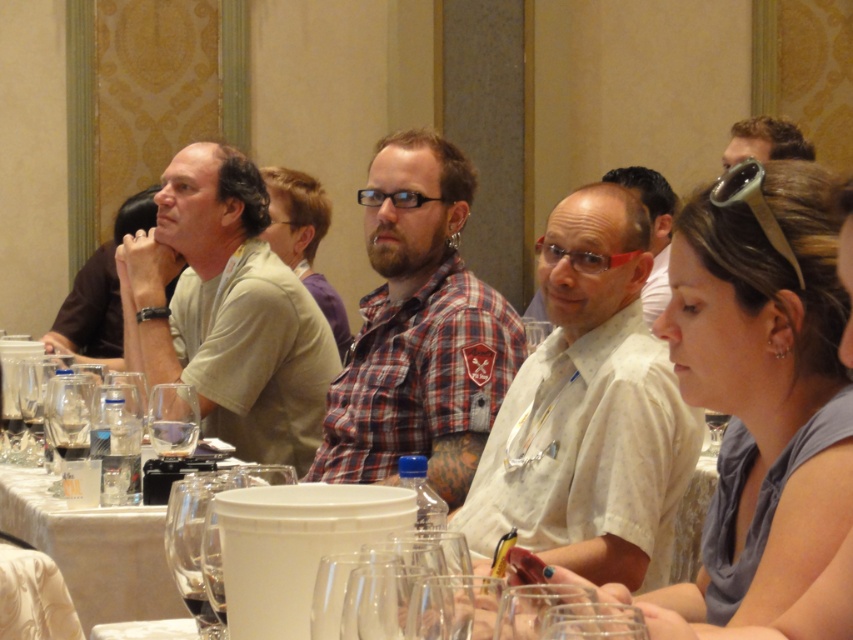
Question: Can you confirm if plaid fabric shirt at center is wider than clear glass wine glass at center?

Choices:
 (A) yes
 (B) no

Answer: (A)

Question: Which of these objects is positioned farthest from the clear glass wine glass at center?

Choices:
 (A) matte white shirt at center
 (B) blonde hair at upper right
 (C) matte black shirt at left

Answer: (B)

Question: Does white dotted shirt at center appear on the left side of clear glass wine glass at center?

Choices:
 (A) no
 (B) yes

Answer: (A)

Question: Among these objects, which one is nearest to the camera?

Choices:
 (A) matte black shirt at left
 (B) clear glass wine glass at center
 (C) blonde hair at upper right
 (D) light beige cotton shirt at left

Answer: (B)

Question: Can you confirm if matte black shirt at left is bigger than clear glass wine glass at center?

Choices:
 (A) no
 (B) yes

Answer: (B)

Question: Which is farther from the light beige cotton shirt at left?

Choices:
 (A) white dotted shirt at center
 (B) plaid fabric shirt at center

Answer: (A)